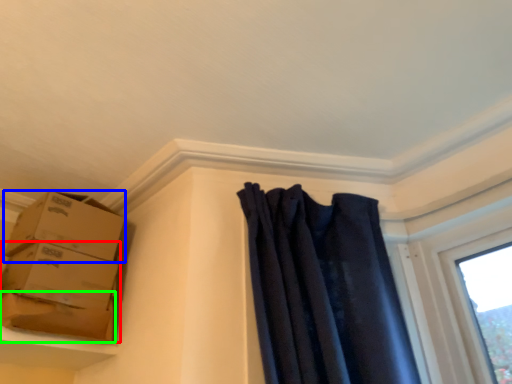
Question: Which object is the closest to the box (highlighted by a red box)? Choose among these: box (highlighted by a blue box) or cardboard box (highlighted by a green box).

Choices:
 (A) box
 (B) cardboard box

Answer: (B)